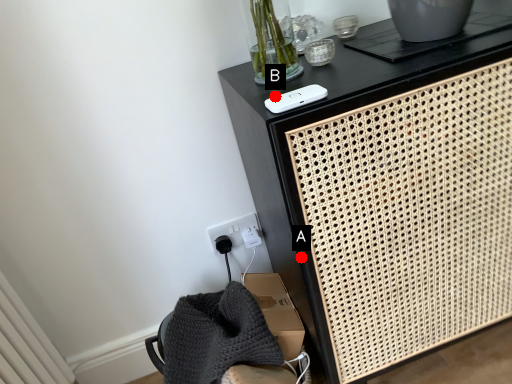
Question: Two points are circled on the image, labeled by A and B beside each circle. Which point is closer to the camera?

Choices:
 (A) A is closer
 (B) B is closer

Answer: (B)